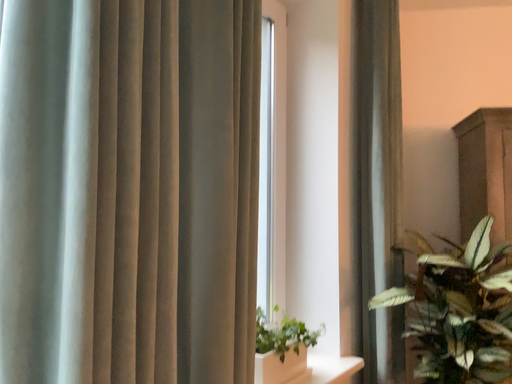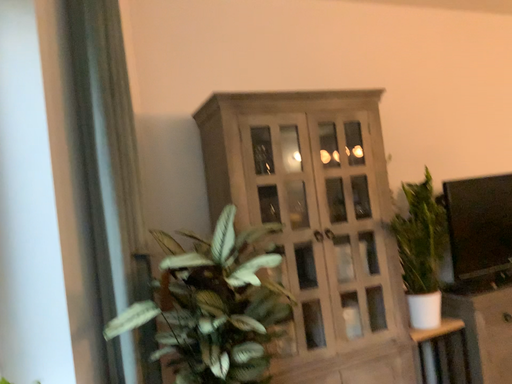
Question: How did the camera likely rotate when shooting the video?

Choices:
 (A) rotated left
 (B) rotated right

Answer: (B)